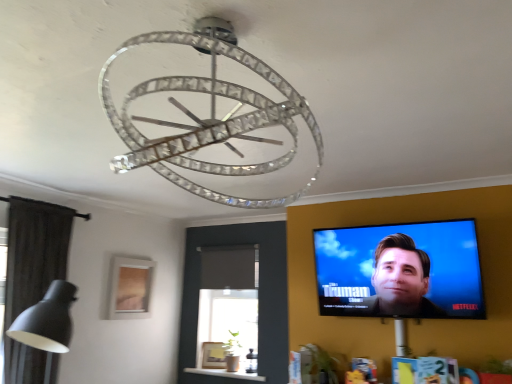
Image resolution: width=512 pixels, height=384 pixels. What are the coordinates of `clear crystal chandelier at center` in the screenshot? It's located at (210, 116).

You are a GUI agent. You are given a task and a screenshot of the screen. Output one action in this format:
    pyautogui.click(x=<x>, y=<y>)
    Task: Click on the matte wooden picture frame at lower left
    This screenshot has height=384, width=512.
    Given the screenshot: What is the action you would take?
    pyautogui.click(x=130, y=288)

The image size is (512, 384). I want to click on clear crystal chandelier at center, so click(210, 116).

Does matte black tv at upper right come in front of matte wooden picture frame at lower left?

Yes, matte black tv at upper right is closer to the viewer.

Is matte black tv at upper right shorter than matte wooden picture frame at lower left?

In fact, matte black tv at upper right may be taller than matte wooden picture frame at lower left.

Does matte black tv at upper right touch matte wooden picture frame at lower left?

No, matte black tv at upper right is not next to matte wooden picture frame at lower left.

From a real-world perspective, is matte black tv at upper right positioned above or below matte wooden picture frame at lower left?

Clearly, from a real-world perspective, matte black tv at upper right is above matte wooden picture frame at lower left.

Choose the correct answer: Is matte black tv at upper right inside clear crystal chandelier at center or outside it?

matte black tv at upper right lies outside clear crystal chandelier at center.

Looking at their sizes, would you say matte black tv at upper right is wider or thinner than clear crystal chandelier at center?

matte black tv at upper right is thinner than clear crystal chandelier at center.

Is matte black tv at upper right with clear crystal chandelier at center?

No, matte black tv at upper right is not in contact with clear crystal chandelier at center.

Is matte black tv at upper right positioned behind clear crystal chandelier at center?

Yes, the depth of matte black tv at upper right is greater than that of clear crystal chandelier at center.

Image resolution: width=512 pixels, height=384 pixels. I want to click on picture frame behind the matte black tv at upper right, so click(130, 288).

From the image's perspective, which object appears higher, matte wooden picture frame at lower left or matte black tv at upper right?

matte black tv at upper right.

Considering the positions of point (123, 285) and point (440, 294), is point (123, 285) closer or farther from the camera than point (440, 294)?

Point (123, 285).

Is matte wooden picture frame at lower left to the right of matte black tv at upper right from the viewer's perspective?

No, matte wooden picture frame at lower left is not to the right of matte black tv at upper right.

Considering the positions of objects clear crystal chandelier at center and matte wooden picture frame at lower left in the image provided, who is more to the right, clear crystal chandelier at center or matte wooden picture frame at lower left?

From the viewer's perspective, clear crystal chandelier at center appears more on the right side.

Does clear crystal chandelier at center have a larger size compared to matte wooden picture frame at lower left?

Indeed, clear crystal chandelier at center has a larger size compared to matte wooden picture frame at lower left.

The image size is (512, 384). Identify the location of picture frame located on the left of clear crystal chandelier at center. (130, 288).

Relative to matte black tv at upper right, is clear crystal chandelier at center in front or behind?

clear crystal chandelier at center is positioned closer to the viewer than matte black tv at upper right.

Which object is thinner, clear crystal chandelier at center or matte black tv at upper right?

matte black tv at upper right.

From a real-world perspective, is clear crystal chandelier at center physically located above or below matte black tv at upper right?

In terms of real-world spatial position, clear crystal chandelier at center is above matte black tv at upper right.

Locate an element on the screen. Image resolution: width=512 pixels, height=384 pixels. lamp on the right of the matte wooden picture frame at lower left is located at coordinates (210, 116).

Is clear crystal chandelier at center at the back of matte wooden picture frame at lower left?

No.

Which of these two, matte wooden picture frame at lower left or clear crystal chandelier at center, is bigger?

clear crystal chandelier at center.

Between matte wooden picture frame at lower left and clear crystal chandelier at center, which one appears on the left side from the viewer's perspective?

matte wooden picture frame at lower left.

Image resolution: width=512 pixels, height=384 pixels. What are the coordinates of `picture frame behind the matte black tv at upper right` in the screenshot? It's located at (130, 288).

Image resolution: width=512 pixels, height=384 pixels. I want to click on lamp above the matte black tv at upper right (from the image's perspective), so [x=210, y=116].

When comparing their distances from clear crystal chandelier at center, does matte wooden picture frame at lower left or matte black tv at upper right seem further?

Based on the image, matte wooden picture frame at lower left appears to be further to clear crystal chandelier at center.

Based on their spatial positions, is matte black tv at upper right or matte wooden picture frame at lower left closer to clear crystal chandelier at center?

matte black tv at upper right lies closer to clear crystal chandelier at center than the other object.

Looking at the image, which one is located further to matte black tv at upper right, matte wooden picture frame at lower left or clear crystal chandelier at center?

Based on the image, matte wooden picture frame at lower left appears to be further to matte black tv at upper right.

In the scene shown: Considering their positions, is matte black tv at upper right positioned further to matte wooden picture frame at lower left than clear crystal chandelier at center?

clear crystal chandelier at center is positioned further to the anchor matte wooden picture frame at lower left.

Considering their positions, is clear crystal chandelier at center positioned further to matte black tv at upper right than matte wooden picture frame at lower left?

matte wooden picture frame at lower left is further to matte black tv at upper right.

Considering their positions, is clear crystal chandelier at center positioned closer to matte wooden picture frame at lower left than matte black tv at upper right?

matte black tv at upper right lies closer to matte wooden picture frame at lower left than the other object.

Identify the location of computer screen between clear crystal chandelier at center and matte wooden picture frame at lower left in the front-back direction. (400, 270).